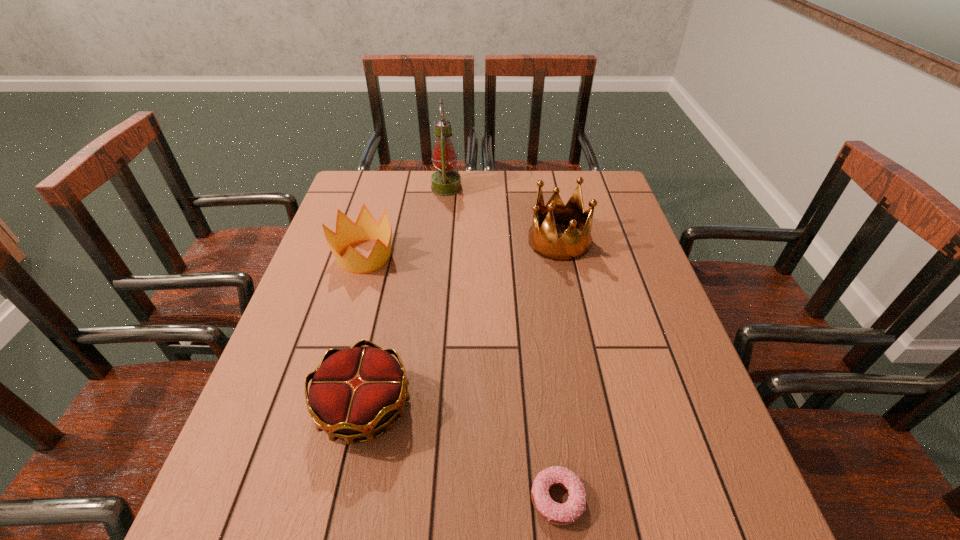
At what (x,y) coordinates should I click in order to perform the action: click on free space located 0.230m on the right of the shortest object. Please return your answer as a coordinate pair (x, y). Looking at the image, I should click on (717, 499).

This screenshot has height=540, width=960. Find the location of `object at the far edge`. object at the far edge is located at coordinates (445, 182).

Where is `object present at the near edge`? object present at the near edge is located at coordinates (566, 513).

Where is `object that is at the right edge`? This screenshot has width=960, height=540. object that is at the right edge is located at coordinates (544, 241).

I want to click on vacant region at the far edge of the desktop, so click(x=447, y=207).

Locate an element on the screen. free spot at the near edge of the desktop is located at coordinates (331, 532).

In the image, there is a desktop. Identify the location of free space at the left edge. 324,277.

In the image, there is a desktop. Where is `vacant space at the right edge`? This screenshot has height=540, width=960. vacant space at the right edge is located at coordinates (634, 313).

The width and height of the screenshot is (960, 540). Identify the location of free space at the far right corner of the desktop. (576, 176).

Image resolution: width=960 pixels, height=540 pixels. Identify the location of free space between the farthest object and the rightmost crown. (503, 214).